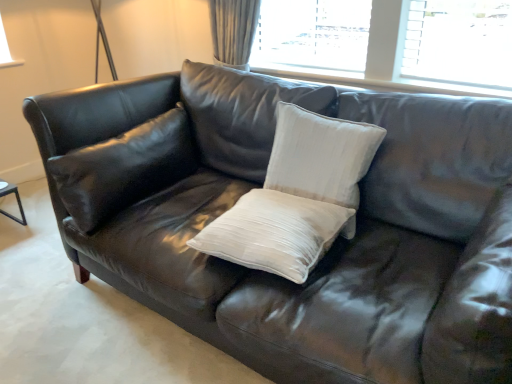
Question: From a real-world perspective, does white textured pillow at center, the 1th pillow positioned from the right, stand above white satin pillow at center, the 2th pillow positioned from the right?

Choices:
 (A) yes
 (B) no

Answer: (A)

Question: Is white textured pillow at center, the 1th pillow positioned from the right, thinner than white satin pillow at center, the second pillow from the left?

Choices:
 (A) yes
 (B) no

Answer: (A)

Question: Does white textured pillow at center, which ranks as the 3th pillow in left-to-right order, have a lesser height compared to white satin pillow at center, the second pillow from the left?

Choices:
 (A) yes
 (B) no

Answer: (B)

Question: From the image's perspective, is white textured pillow at center, the 1th pillow positioned from the right, located beneath white satin pillow at center, the 2th pillow positioned from the right?

Choices:
 (A) yes
 (B) no

Answer: (B)

Question: Is white textured pillow at center, the 1th pillow positioned from the right, closer to camera compared to white satin pillow at center, the second pillow from the left?

Choices:
 (A) yes
 (B) no

Answer: (B)

Question: Are white textured pillow at center, the 1th pillow positioned from the right, and white satin pillow at center, the 2th pillow positioned from the right, far apart?

Choices:
 (A) no
 (B) yes

Answer: (A)

Question: Could you tell me if white satin pillow at center, the 2th pillow positioned from the right, is turned towards white textured pillow at center, the 1th pillow positioned from the right?

Choices:
 (A) no
 (B) yes

Answer: (A)

Question: Is white satin pillow at center, the second pillow from the left, facing away from white textured pillow at center, which ranks as the 3th pillow in left-to-right order?

Choices:
 (A) yes
 (B) no

Answer: (A)

Question: Considering the relative positions of white satin pillow at center, the 2th pillow positioned from the right, and white textured pillow at center, which ranks as the 3th pillow in left-to-right order, in the image provided, is white satin pillow at center, the 2th pillow positioned from the right, to the left of white textured pillow at center, which ranks as the 3th pillow in left-to-right order, from the viewer's perspective?

Choices:
 (A) yes
 (B) no

Answer: (A)

Question: Considering the relative sizes of white satin pillow at center, the 2th pillow positioned from the right, and white textured pillow at center, the 1th pillow positioned from the right, in the image provided, is white satin pillow at center, the 2th pillow positioned from the right, shorter than white textured pillow at center, the 1th pillow positioned from the right,?

Choices:
 (A) yes
 (B) no

Answer: (A)

Question: Does white satin pillow at center, the second pillow from the left, have a greater width compared to white textured pillow at center, which ranks as the 3th pillow in left-to-right order?

Choices:
 (A) yes
 (B) no

Answer: (A)

Question: Is white satin pillow at center, the second pillow from the left, outside of white textured pillow at center, the 1th pillow positioned from the right?

Choices:
 (A) yes
 (B) no

Answer: (A)

Question: Does matte black pillow at left, placed as the 3th pillow when sorted from right to left, appear on the right side of white textured pillow at center, the 1th pillow positioned from the right?

Choices:
 (A) yes
 (B) no

Answer: (B)